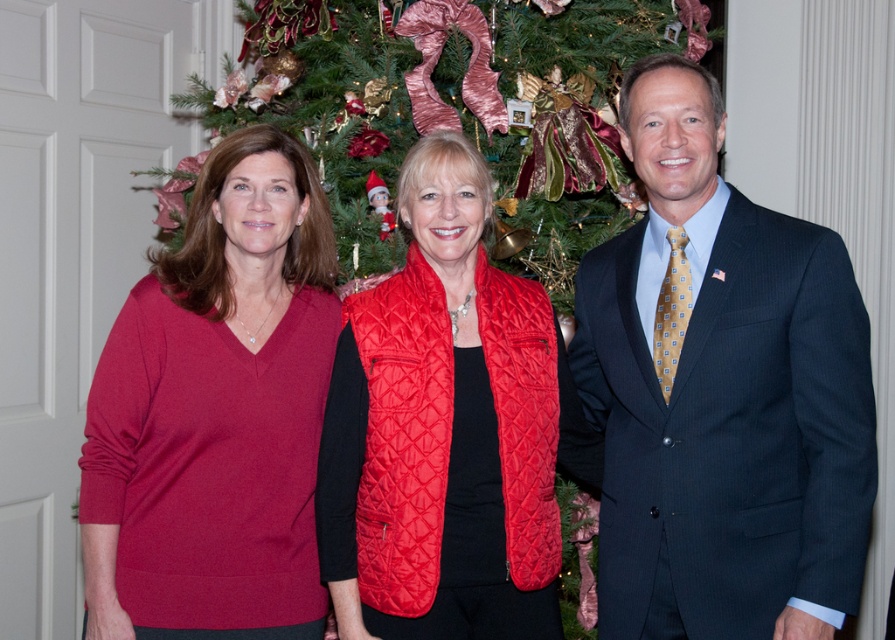
You are a photographer setting up a tripod to take a group photo of the people and the Christmas tree. The matte red sweater at left and the green textured christmas tree at center are both in your frame. Which object will appear taller in the photo?

The matte red sweater at left will appear taller in the photo since it has a greater height compared to the green textured christmas tree at center according to the description.

You are a photographer setting up for a group photo. You need to ensure that the dark blue suit at center and the quilted red vest at center are clearly visible in the frame. Given that your camera has a depth of field that can sharply focus on objects within a 12 inch range, will both subjects be in focus?

The dark blue suit at center is 13.01 inches away from quilted red vest at center. Since the distance between them exceeds the camera sensor depth of field range of 12 inches, only one of them will be in focus at a time. To capture both sharply, adjust the focus midpoint or use a smaller aperture for greater depth of field.

In the scene shown: You are a photographer standing 5 feet away from the matte red sweater at left. Can you take a clear photo of it without moving closer?

The photographer is 4.99 feet away from the matte red sweater at left, which is just under 5 feet. Since the distance is slightly less than 5 feet, the photographer can take a clear photo of the matte red sweater at left without needing to move closer.